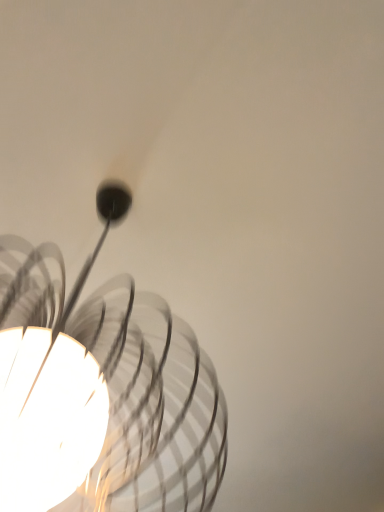
You are a GUI agent. You are given a task and a screenshot of the screen. Output one action in this format:
    pyautogui.click(x=<x>, y=<y>)
    Task: Click on the matte black lampshade at lower left
    Image resolution: width=384 pixels, height=512 pixels.
    Given the screenshot: What is the action you would take?
    pyautogui.click(x=102, y=391)

This screenshot has width=384, height=512. What do you see at coordinates (102, 391) in the screenshot? I see `matte black lampshade at lower left` at bounding box center [102, 391].

This screenshot has width=384, height=512. Identify the location of matte black lampshade at lower left. (102, 391).